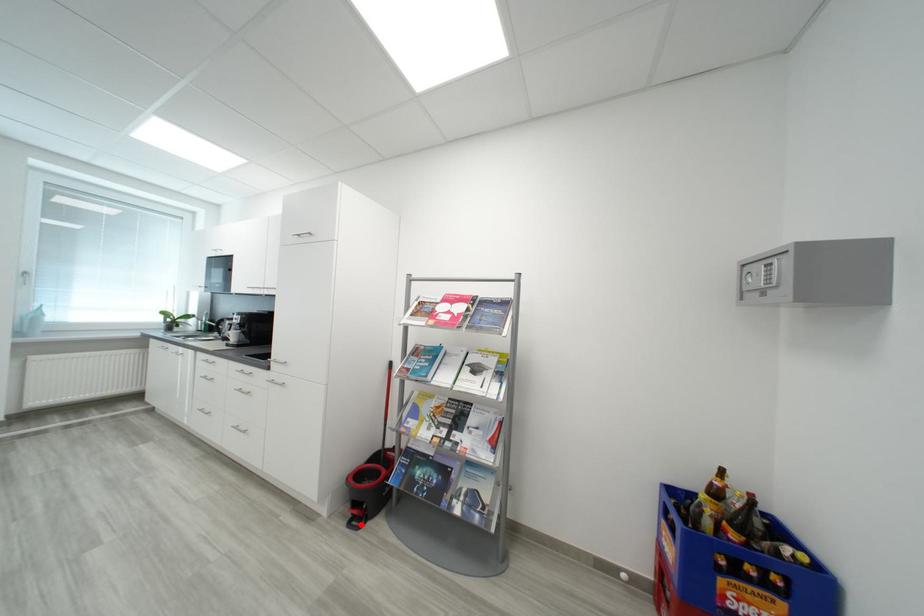
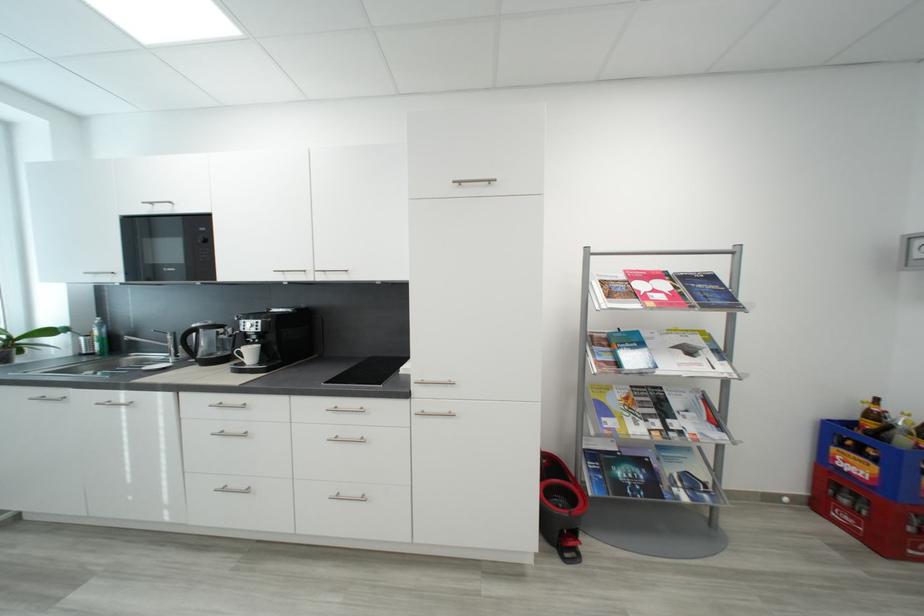
Question: I am providing you with two images of the same scene from different viewpoints. A red point is marked on the first image. At the location where the point appears in image 1, is it still visible in image 2?

Choices:
 (A) Yes
 (B) No

Answer: (A)